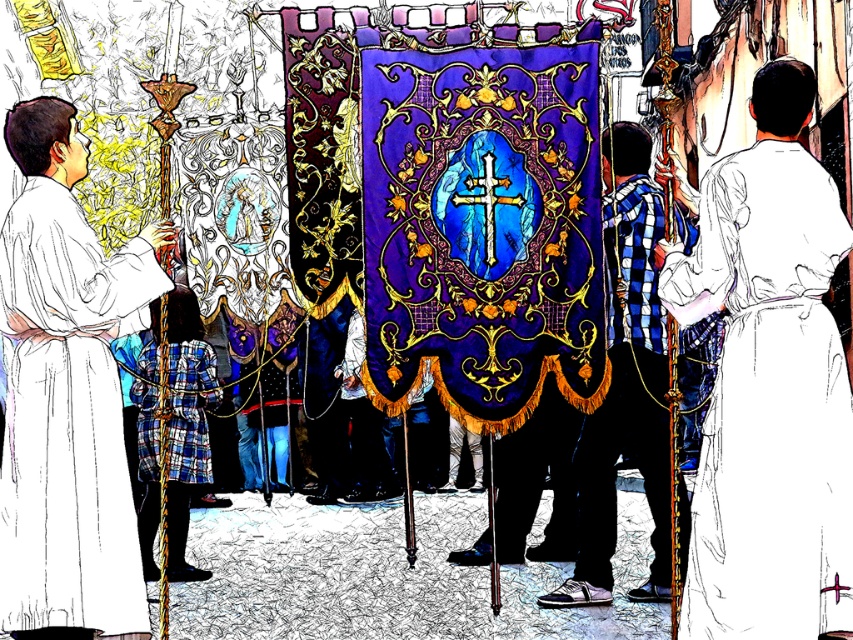
Can you confirm if blue plaid shirt at center is bigger than plaid fabric robe at center?

Yes, blue plaid shirt at center is bigger than plaid fabric robe at center.

Based on the photo, can you confirm if blue plaid shirt at center is positioned to the right of plaid fabric robe at center?

Yes, blue plaid shirt at center is to the right of plaid fabric robe at center.

Does point (614, 196) come in front of point (154, 440)?

Yes, point (614, 196) is closer to viewer.

You are a GUI agent. You are given a task and a screenshot of the screen. Output one action in this format:
    pyautogui.click(x=<x>, y=<y>)
    Task: Click on the blue plaid shirt at center
    This screenshot has height=640, width=853.
    Given the screenshot: What is the action you would take?
    pyautogui.click(x=625, y=381)

Is point (786, 362) less distant than point (93, 328)?

That is True.

Is white cloth robe at right positioned at the back of white cloth robe at left?

No, it is in front of white cloth robe at left.

Who is more forward, [738,381] or [99,602]?

Point [738,381]

Find the location of a particular element. The image size is (853, 640). white cloth robe at right is located at coordinates (769, 401).

Who is more forward, [798,268] or [614,208]?

Point [798,268] is in front.

Between point (711, 252) and point (631, 328), which one is positioned in front?

Positioned in front is point (711, 252).

The height and width of the screenshot is (640, 853). I want to click on white cloth robe at right, so click(769, 401).